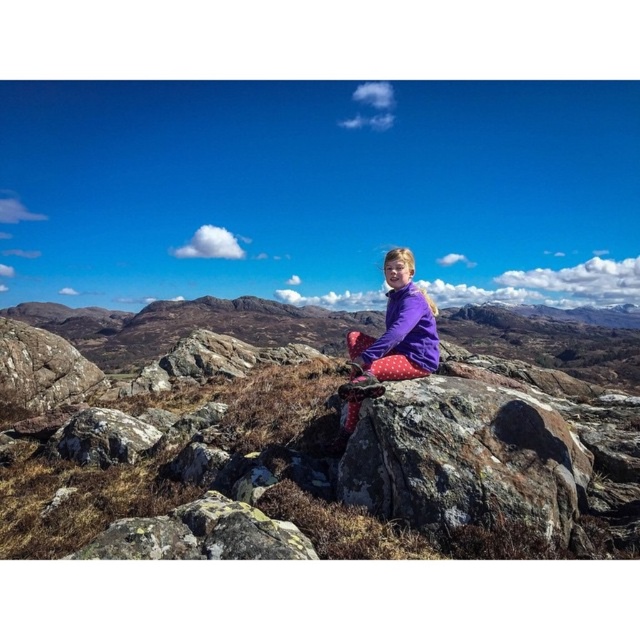
Is rough textured rock at left bigger than rough gray rock at center?

Correct, rough textured rock at left is larger in size than rough gray rock at center.

Can you confirm if rough textured rock at left is smaller than rough gray rock at center?

Actually, rough textured rock at left might be larger than rough gray rock at center.

Is point (6, 390) farther from viewer compared to point (156, 428)?

Yes, it is.

Where is `rough textured rock at left`? The image size is (640, 640). rough textured rock at left is located at coordinates (42, 369).

Can you confirm if rough textured rock at center is taller than purple fleece jacket at center?

No.

Who is more forward, [422,499] or [403,273]?

Point [422,499] is more forward.

Image resolution: width=640 pixels, height=640 pixels. Find the location of `rough textured rock at center`. rough textured rock at center is located at coordinates (465, 458).

Is point (406, 499) farther from camera compared to point (97, 461)?

No.

This screenshot has width=640, height=640. What do you see at coordinates (465, 458) in the screenshot? I see `rough textured rock at center` at bounding box center [465, 458].

Locate an element on the screen. The height and width of the screenshot is (640, 640). rough textured rock at center is located at coordinates (465, 458).